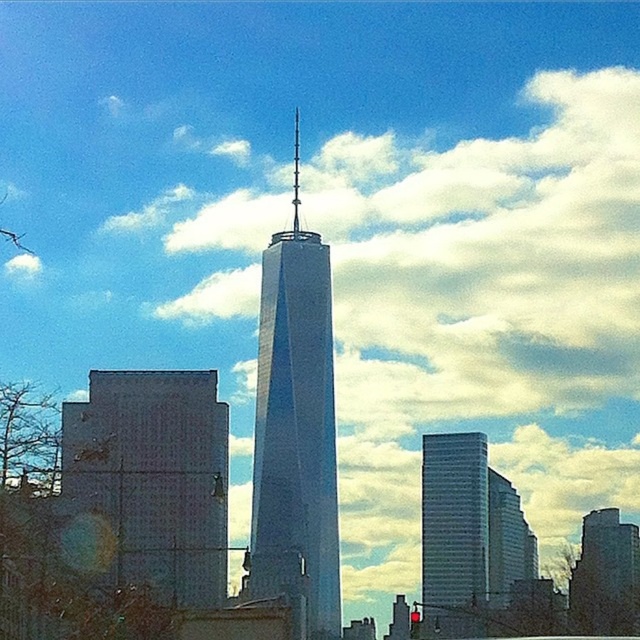
Is gray concrete building at lower left shorter than dark gray stone tower at center?

No, gray concrete building at lower left is not shorter than dark gray stone tower at center.

Is gray concrete building at lower left to the left of dark gray stone tower at center from the viewer's perspective?

Indeed, gray concrete building at lower left is positioned on the left side of dark gray stone tower at center.

Locate an element on the screen. The image size is (640, 640). gray concrete building at lower left is located at coordinates (154, 477).

Image resolution: width=640 pixels, height=640 pixels. I want to click on gray concrete building at lower left, so click(x=154, y=477).

Can you confirm if glassy steel skyscraper at center is taller than dark gray stone tower at center?

Yes.

Does glassy steel skyscraper at center appear under dark gray stone tower at center?

No.

Is point (328, 556) positioned behind point (624, 560)?

No, it is in front of (624, 560).

The height and width of the screenshot is (640, 640). Find the location of `glassy steel skyscraper at center`. glassy steel skyscraper at center is located at coordinates (296, 426).

From the picture: Is gray concrete building at lower left further to the viewer compared to glassy steel skyscraper at center?

That is True.

Who is positioned more to the right, gray concrete building at lower left or glassy steel skyscraper at center?

glassy steel skyscraper at center is more to the right.

Image resolution: width=640 pixels, height=640 pixels. Find the location of `gray concrete building at lower left`. gray concrete building at lower left is located at coordinates (154, 477).